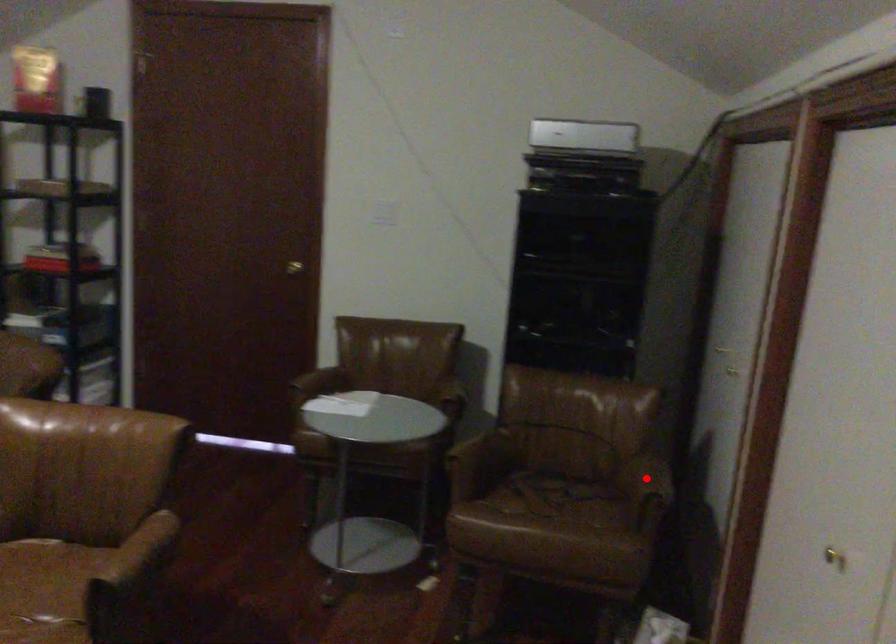
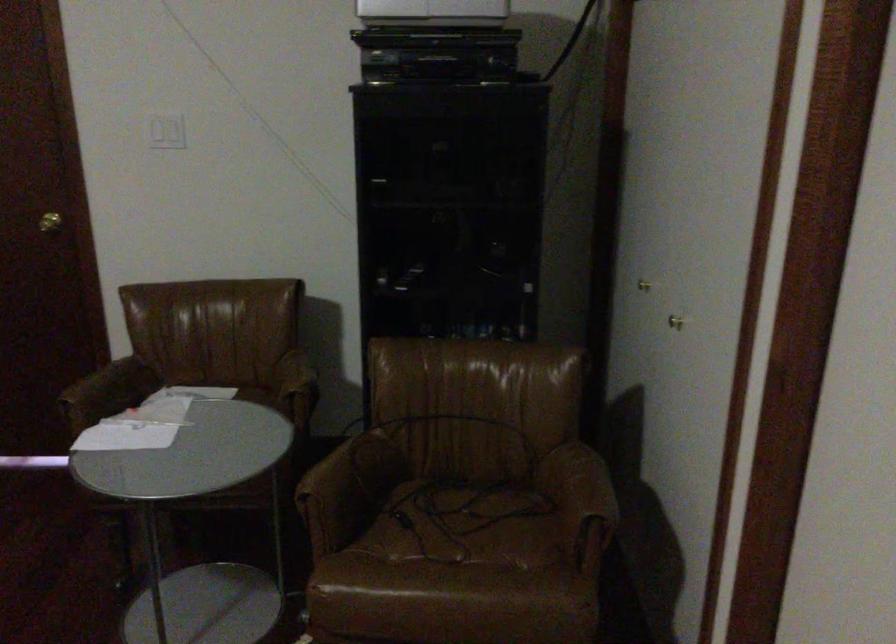
Question: I am providing you with two images of the same scene from different viewpoints. Given a red point in image1, look at the same physical point in image2. Is it:

Choices:
 (A) Closer to the viewpoint
 (B) Farther from the viewpoint

Answer: (A)